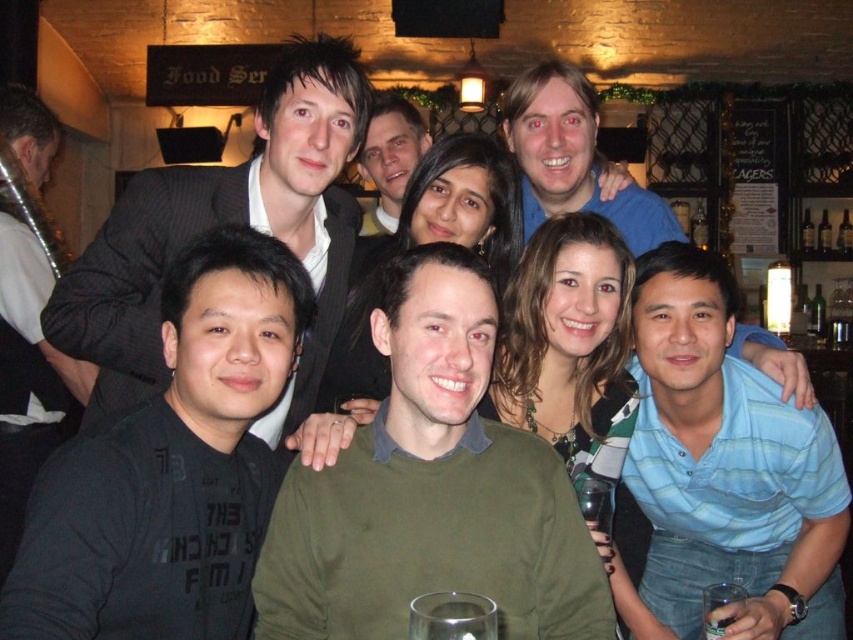
You are standing at the entrance of the bar and want to take a photo of the group. The photographer tells you to move to the point closer to the camera between point (674, 467) and point (538, 163). Which point should you move to?

You should move to point (674, 467) because it is in front of point (538, 163) and closer to the camera.

You are at a bar with friends and need to locate two people wearing blue shirts. The first is wearing a blue striped shirt at lower right, and the second is wearing a blue shirt at upper center. From the perspective of someone standing in front of the group, which blue shirt is positioned to the right of the other?

The blue striped shirt at lower right is to the right of the blue shirt at upper center.